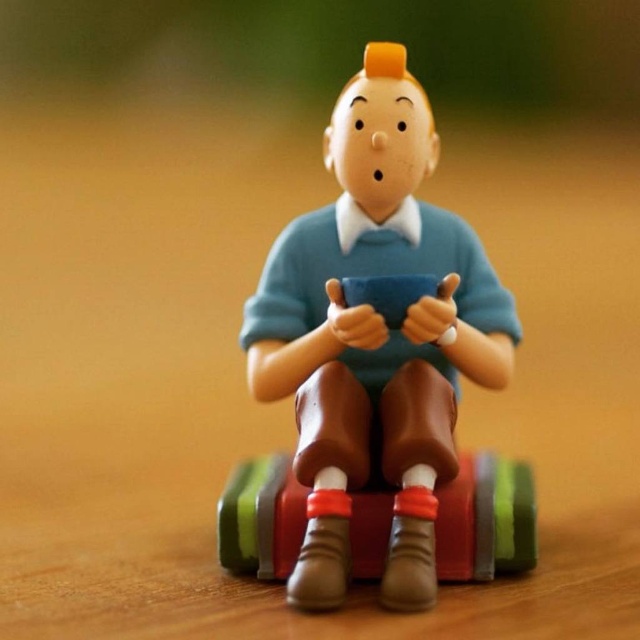
You are a collector who wants to display the matte plastic figure at center and the rubberized plastic suitcase at center on a shelf. The shelf has a maximum length of 15 centimeters. Can both items fit side by side without overlapping?

The matte plastic figure at center and the rubberized plastic suitcase at center are 14.72 centimeters apart, so they can fit side by side on the 15 centimeter shelf without overlapping since the total required space is less than the shelf length.

You are a collector who wants to place both the matte plastic figure at center and the rubberized plastic suitcase at center on a shelf. The shelf has a maximum width capacity of 20 cm. If the total width of both items combined is 25 cm, will they fit together on the shelf?

The matte plastic figure at center has a lesser width compared to the rubberized plastic suitcase at center. However, their combined total width is 25 cm, which exceeds the shelf capacity of 20 cm. Therefore, they cannot fit together on the shelf.

You are a collector who wants to display both the matte plastic figure at center and the rubberized plastic suitcase at center on a shelf. Given their sizes, which object should be placed first to ensure stability?

The matte plastic figure at center is taller than the rubberized plastic suitcase at center, so to ensure stability, place the heavier or wider object first. However, since the description only mentions height, you might want to place the taller matte plastic figure at center at the back or center of the shelf to balance the display.